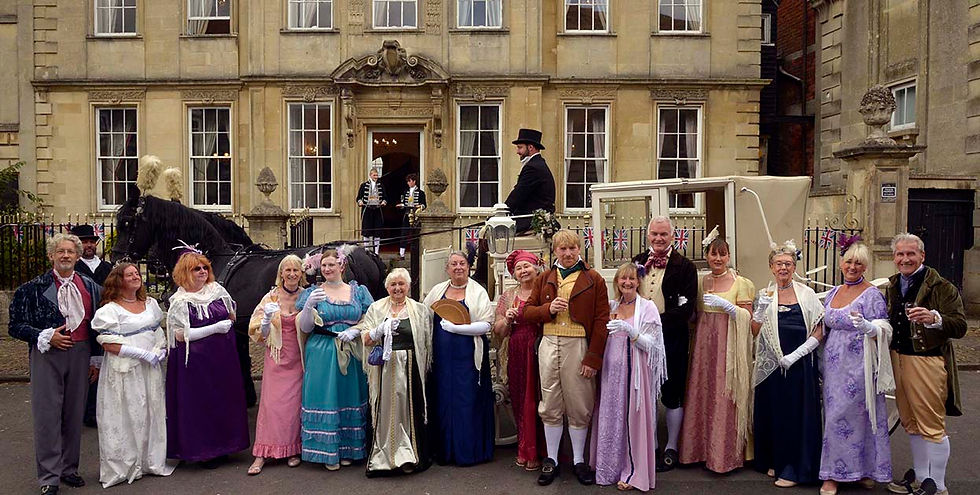
Find the location of a particular element. Image resolution: width=980 pixels, height=495 pixels. open doorway is located at coordinates (390, 151).